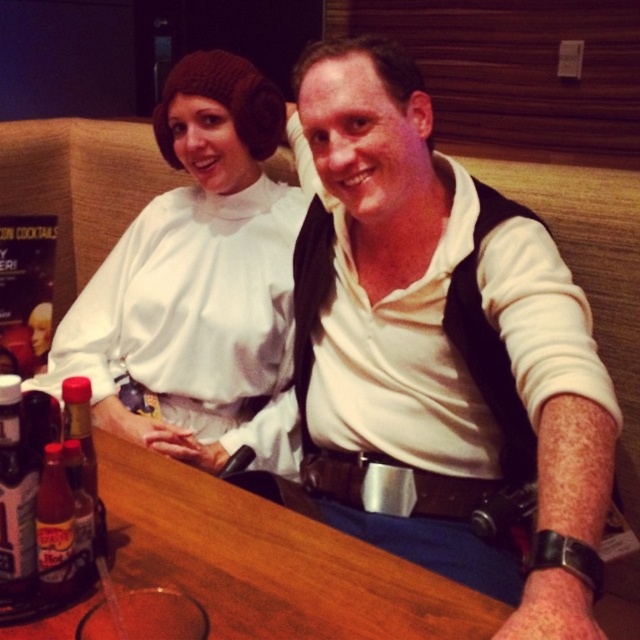
Looking at this image, you are taking a photo of the two characters at the table. You want to focus on the point closer to the camera. Which point should you choose between point [72,552] and point [92,547]?

Point [72,552] is closer to the camera than point [92,547], so you should choose point [72,552] to focus on.

You are a person who wants to pour the contents of the translucent plastic bottle at table left into the translucent glass bottle at center. Can you do this without moving either bottle?

The translucent plastic bottle at table left is only 0.83 inches away from the translucent glass bottle at center, which is too close to pour the contents without moving them. You would need to move at least one of the bottles to create enough space for pouring.

You are taking a photo of the two Star Wars characters at the table. You want to focus on the point closer to the camera. Which point should you choose between point (253, 380) and point (26, 524)?

Point (253, 380) is further to the camera than point (26, 524), so you should choose point (253, 380) to focus on the closer point.